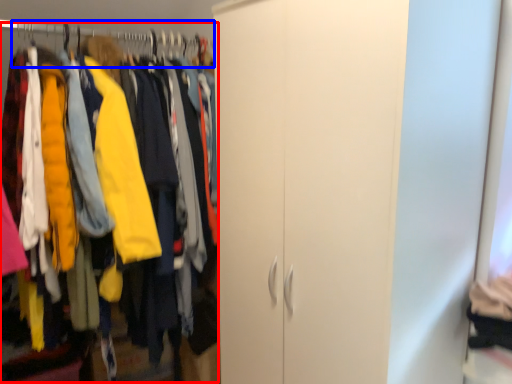
Question: Which object appears closest to the camera in this image, closet (highlighted by a red box) or hanger (highlighted by a blue box)?

Choices:
 (A) closet
 (B) hanger

Answer: (A)